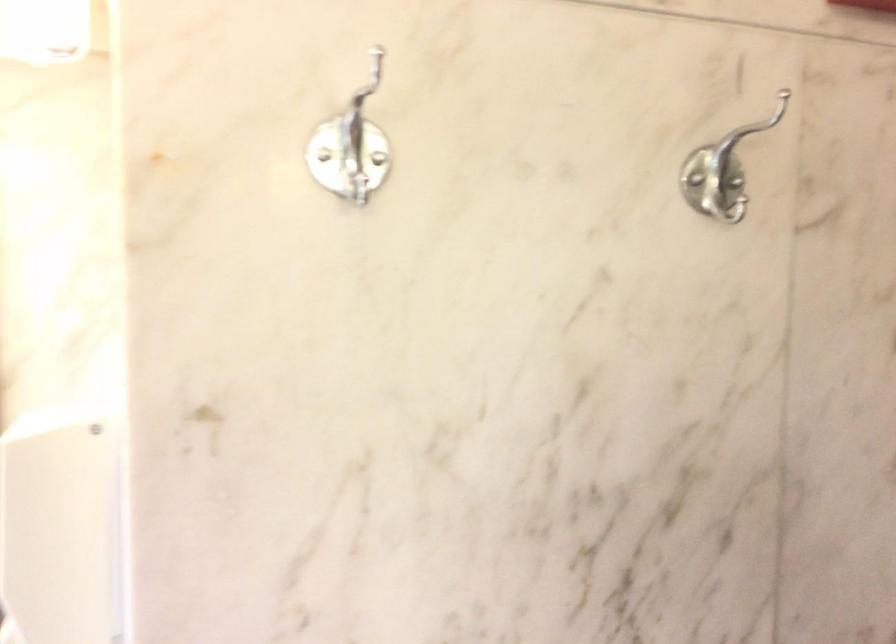
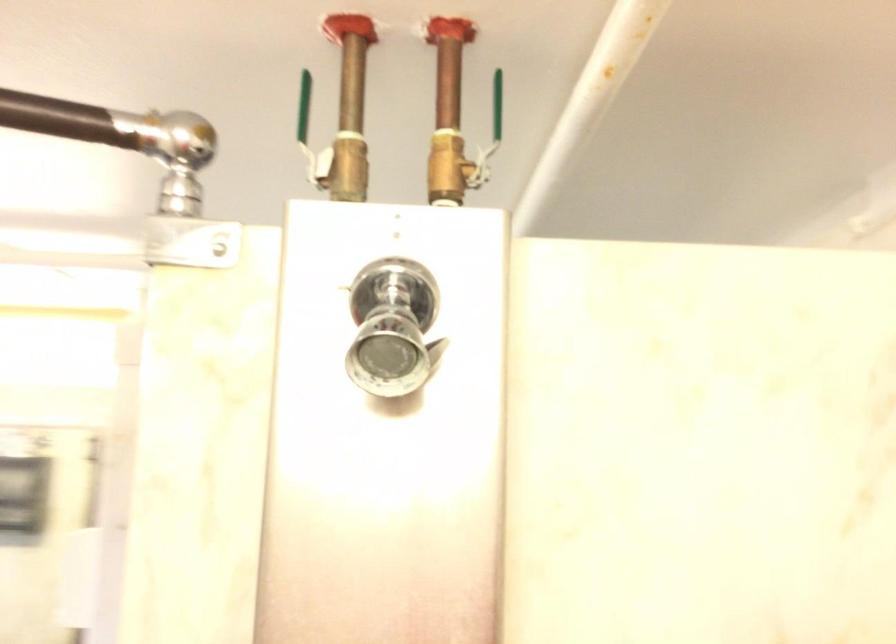
The images are taken continuously from a first-person perspective. In which direction are you moving?

The movement direction of the cameraman is right, backward.